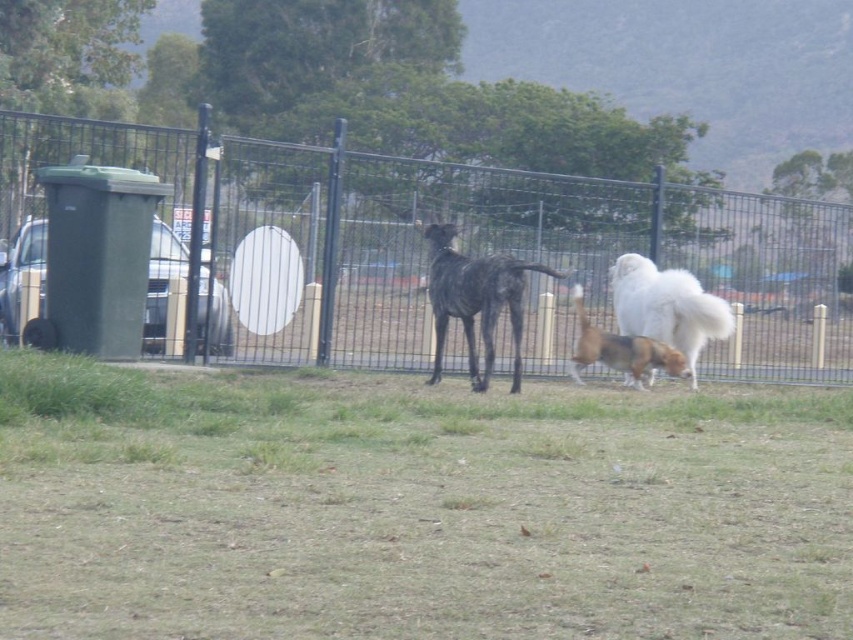
Question: Which of the following is the closest to the observer?

Choices:
 (A) shiny black dog at center
 (B) black metal fence at center
 (C) white fluffy dog at center

Answer: (A)

Question: Can you confirm if black metal fence at center is bigger than shiny black dog at center?

Choices:
 (A) no
 (B) yes

Answer: (A)

Question: Which point is farther to the camera?

Choices:
 (A) (589, 333)
 (B) (474, 288)

Answer: (A)

Question: Among these points, which one is nearest to the camera?

Choices:
 (A) (436, 260)
 (B) (666, 241)
 (C) (653, 275)
 (D) (625, 362)

Answer: (A)

Question: Is shiny black dog at center smaller than white fluffy dog at center?

Choices:
 (A) yes
 (B) no

Answer: (B)

Question: Is shiny black dog at center above white fluffy dog at center?

Choices:
 (A) yes
 (B) no

Answer: (A)